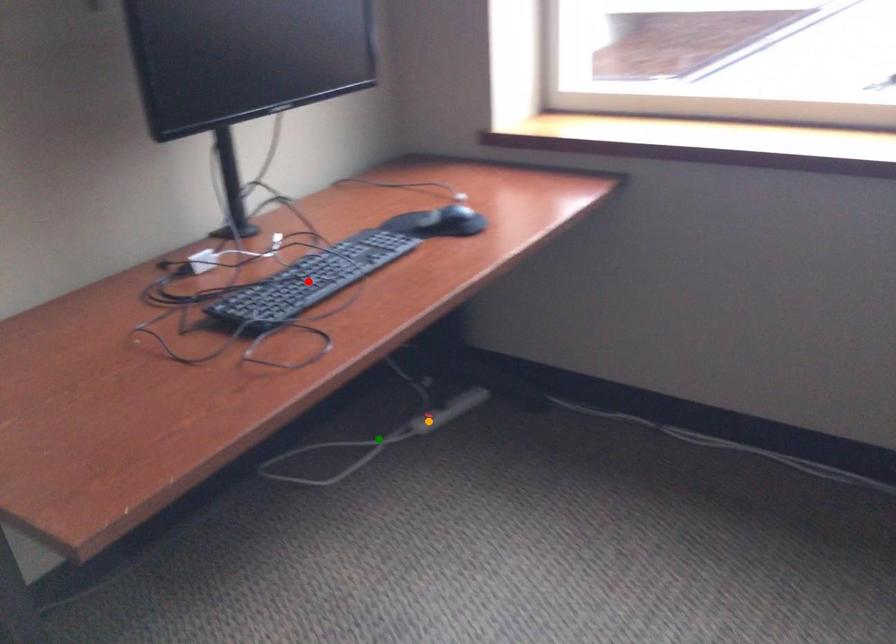
In the scene shown: Order these from nearest to farthest:
A) orange point
B) red point
C) green point

red point < green point < orange point